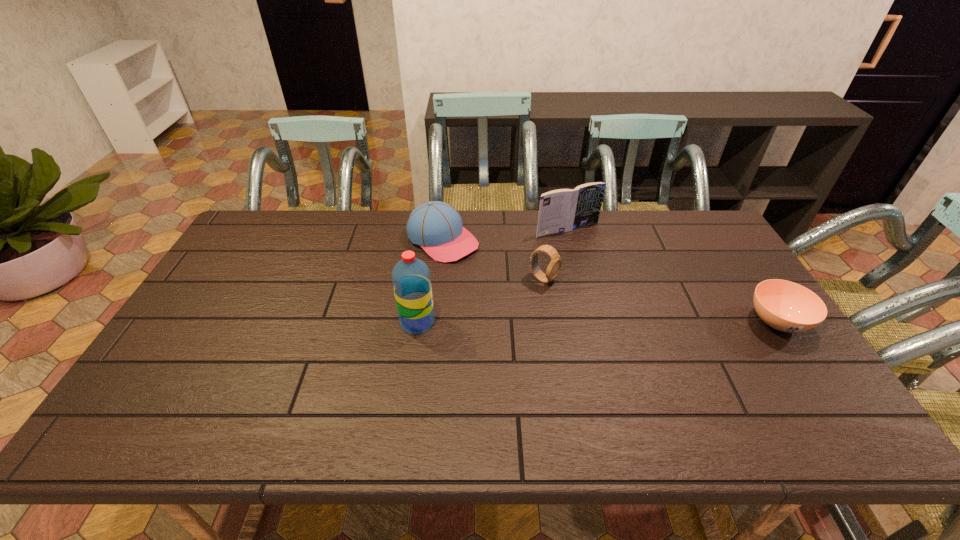
I want to click on water bottle, so click(x=411, y=279).

You are a GUI agent. You are given a task and a screenshot of the screen. Output one action in this format:
    pyautogui.click(x=<x>, y=<y>)
    Task: Click on the rightmost object
    The image size is (960, 540).
    Given the screenshot: What is the action you would take?
    pyautogui.click(x=786, y=306)

The image size is (960, 540). I want to click on soup bowl, so click(x=786, y=306).

Locate an element on the screen. the third farthest object is located at coordinates (555, 264).

I want to click on the fourth shortest object, so click(x=562, y=210).

This screenshot has height=540, width=960. In order to click on baseball cap in this screenshot , I will do point(437,227).

Find the location of `vacant region located on the front label of the tallest object`. vacant region located on the front label of the tallest object is located at coordinates (471, 322).

This screenshot has height=540, width=960. I want to click on vacant area situated 0.260m on the left of the rightmost object, so click(653, 322).

You are a GUI agent. You are given a task and a screenshot of the screen. Output one action in this format:
    pyautogui.click(x=<x>, y=<y>)
    Task: Click on the vacant space positioned on the face of the third nearest object
    This screenshot has width=960, height=540.
    Given the screenshot: What is the action you would take?
    pyautogui.click(x=585, y=300)

Where is `free space located on the face of the third nearest object`? The height and width of the screenshot is (540, 960). free space located on the face of the third nearest object is located at coordinates (642, 330).